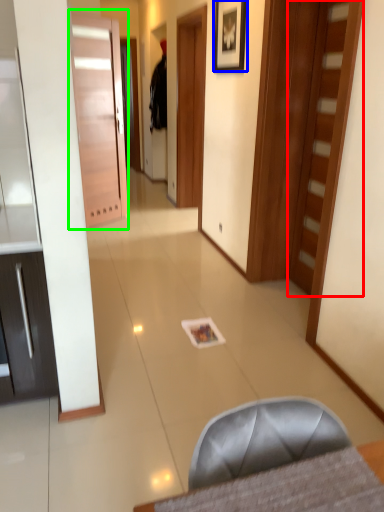
Question: Which is farther away from door (highlighted by a red box)? picture frame (highlighted by a blue box) or door (highlighted by a green box)?

Choices:
 (A) picture frame
 (B) door

Answer: (B)